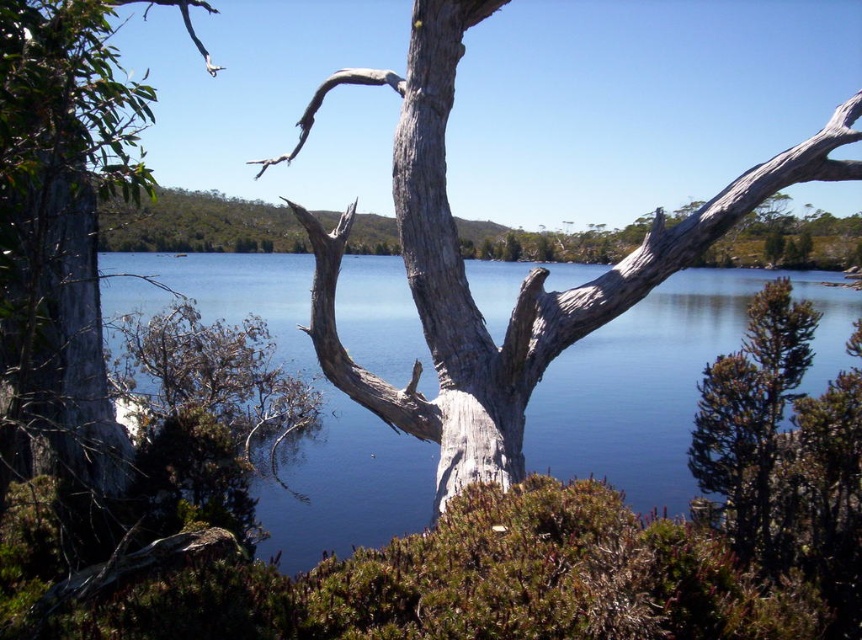
You are an environmental scientist assessing the landscape. You need to determine which area is wider between the blue water at center and the gray rough bark tree at left. Based on the scene, which one is wider?

The blue water at center is wider than the gray rough bark tree at left according to the description.

You are an artist planning to paint this scene. You want to ensure that the blue water at center and the gray rough bark tree at left are proportionally accurate. Which object should you paint first to maintain the correct proportions?

You should paint the gray rough bark tree at left first because it occupies more space in the image than the blue water at center, as the blue water at center takes up less area. By starting with the larger object, you can ensure proper scaling when adding the smaller blue water at center.

You are standing at the edge of the water in the scene and want to walk to the point labeled point (22, 320). However, there is an obstacle at point (425, 384) blocking your path. Can you safely navigate around the obstacle to reach your destination?

Since point (425, 384) is closer to you than point (22, 320), you can walk around the obstacle by moving either to the left or right of point (425, 384) to reach point (22, 320) safely.